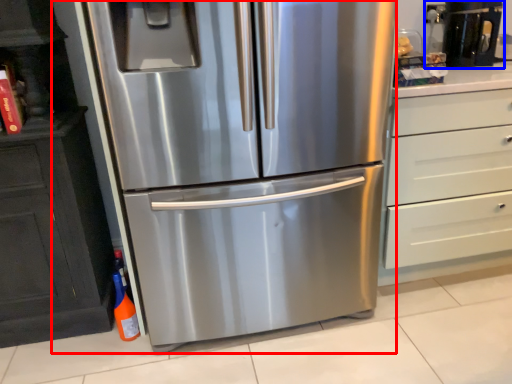
Question: Which point is further to the camera, refrigerator (highlighted by a red box) or coffee machine (highlighted by a blue box)?

Choices:
 (A) refrigerator
 (B) coffee machine

Answer: (B)